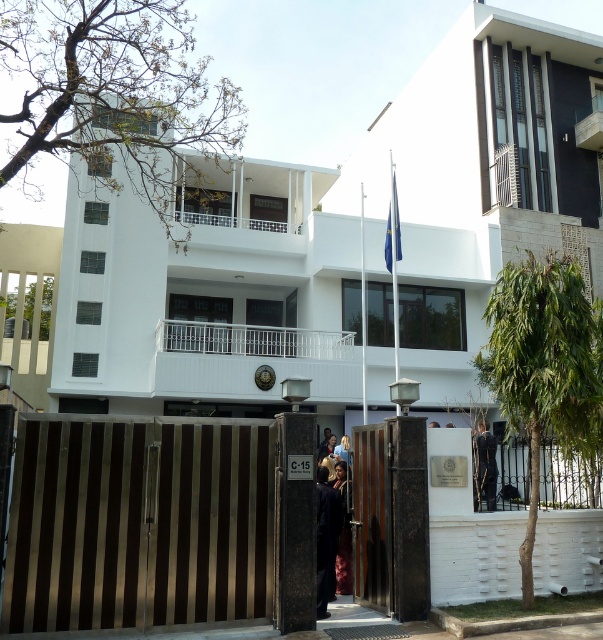
You are a delivery person trying to enter the building through the gold metallic gate at center. You are carrying a dark blue fabric coat at center. The gate has a width restriction of 1.2 meters. Can you pass through the gate with the coat?

The gold metallic gate at center is wider than the dark blue fabric coat at center, so you can pass through the gate with the coat as long as the coat does not exceed the 1.2 meters width restriction. However, the exact width of the coat is not provided, so you should check if it fits within the limit.

You are standing in front of the building and want to locate two specific points marked on the image. The first point is at coordinate point (77, 580) and the second is at point (493, 486). Which of these two points is closer to the entrance of the building?

Point (77, 580) is in front of point (493, 486), so it is closer to the entrance of the building.